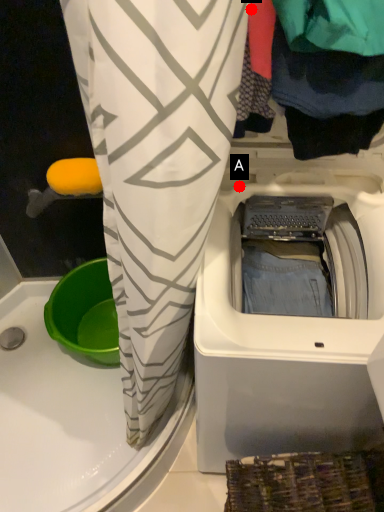
Question: Two points are circled on the image, labeled by A and B beside each circle. Which point is closer to the camera?

Choices:
 (A) A is closer
 (B) B is closer

Answer: (B)